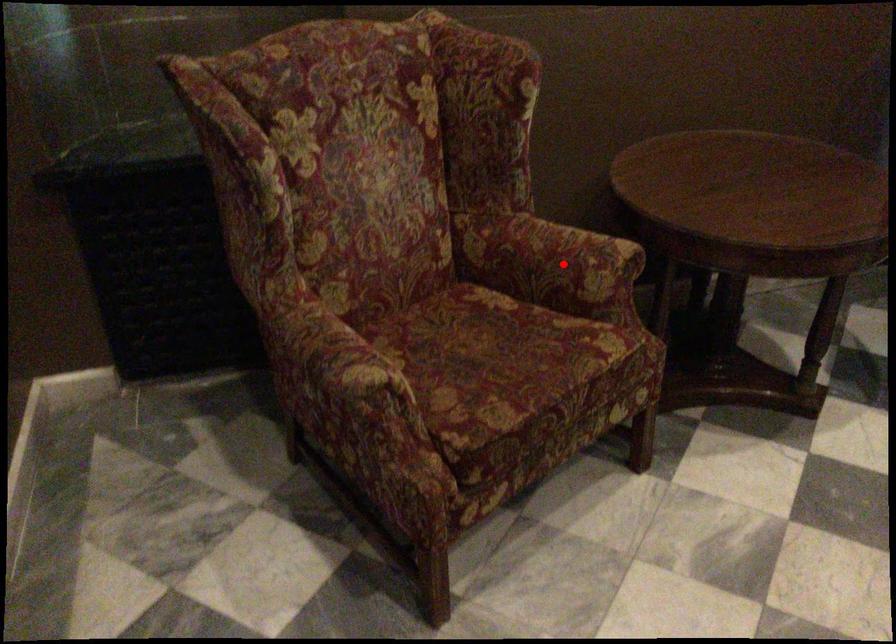
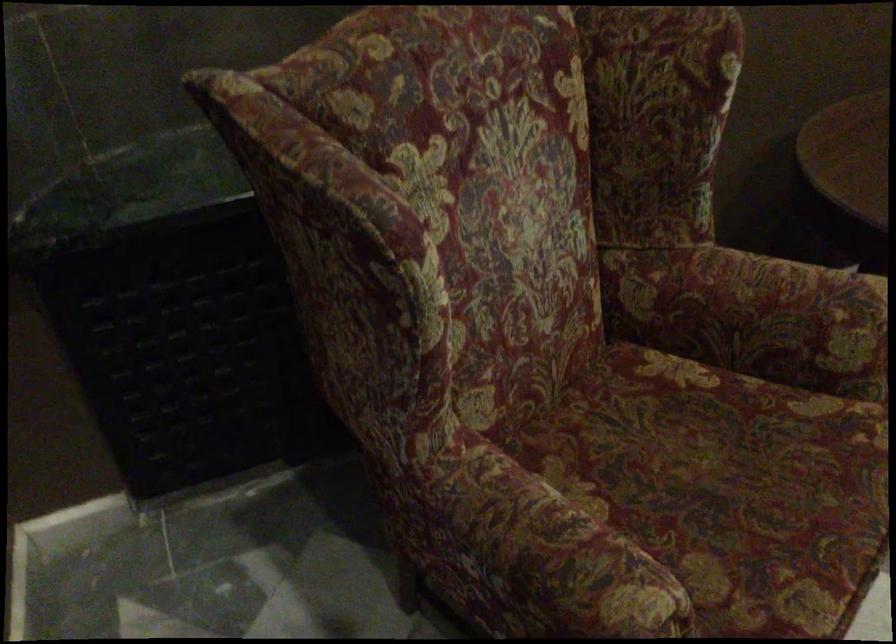
Question: I am providing you with two images of the same scene from different viewpoints. A red point is shown in image1. For the corresponding object point in image2, is it positioned nearer or farther from the camera?

Choices:
 (A) Nearer
 (B) Farther

Answer: (A)